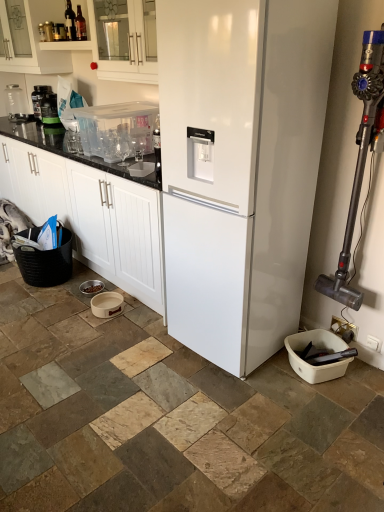
Question: Could you tell me if white glossy cabinet at center, acting as the first cabinetry starting from the bottom, is turned towards clear plastic container at upper left, marked as the 7th appliance in a front-to-back arrangement?

Choices:
 (A) yes
 (B) no

Answer: (B)

Question: Would you consider white glossy cabinet at center, acting as the first cabinetry starting from the bottom, to be distant from clear plastic container at upper left, the 1th appliance positioned from the left?

Choices:
 (A) yes
 (B) no

Answer: (A)

Question: Is white glossy cabinet at center, acting as the third cabinetry starting from the top, smaller than clear plastic container at upper left, the 1th appliance positioned from the left?

Choices:
 (A) yes
 (B) no

Answer: (B)

Question: Is white glossy cabinet at center, acting as the first cabinetry starting from the bottom, not inside clear plastic container at upper left, which is the 1th appliance in back-to-front order?

Choices:
 (A) yes
 (B) no

Answer: (A)

Question: Does white glossy cabinet at center, acting as the third cabinetry starting from the top, contain clear plastic container at upper left, acting as the seventh appliance starting from the right?

Choices:
 (A) no
 (B) yes

Answer: (A)

Question: From a real-world perspective, is beige ceramic bowl at lower center, positioned as the fourth appliance in back-to-front order, positioned above or below matte black coffee maker at left, placed as the fifth appliance when sorted from right to left?

Choices:
 (A) above
 (B) below

Answer: (B)

Question: From the image's perspective, is beige ceramic bowl at lower center, which is the fourth appliance in right-to-left order, located above or below matte black coffee maker at left, which is the 3th appliance in left-to-right order?

Choices:
 (A) above
 (B) below

Answer: (B)

Question: In terms of width, does beige ceramic bowl at lower center, which ranks as the 4th appliance in left-to-right order, look wider or thinner when compared to matte black coffee maker at left, which is the 5th appliance in front-to-back order?

Choices:
 (A) wide
 (B) thin

Answer: (A)

Question: Is beige ceramic bowl at lower center, positioned as the fourth appliance in back-to-front order, spatially inside matte black coffee maker at left, which ranks as the third appliance in back-to-front order, or outside of it?

Choices:
 (A) inside
 (B) outside

Answer: (B)

Question: Considering their positions, is dark glass bottle at upper left located in front of or behind transparent plastic container at upper left, arranged as the fifth appliance when viewed from the back?

Choices:
 (A) front
 (B) behind

Answer: (B)

Question: Is dark glass bottle at upper left wider or thinner than transparent plastic container at upper left, placed as the fifth appliance when sorted from left to right?

Choices:
 (A) wide
 (B) thin

Answer: (B)

Question: Visually, is dark glass bottle at upper left positioned to the left or to the right of transparent plastic container at upper left, the third appliance viewed from the front?

Choices:
 (A) left
 (B) right

Answer: (A)

Question: Choose the correct answer: Is dark glass bottle at upper left inside transparent plastic container at upper left, the third appliance viewed from the front, or outside it?

Choices:
 (A) outside
 (B) inside

Answer: (A)

Question: In terms of size, does clear plastic container at upper left, the 1th appliance positioned from the left, appear bigger or smaller than dark glass bottle at upper left?

Choices:
 (A) big
 (B) small

Answer: (A)

Question: From a real-world perspective, is clear plastic container at upper left, marked as the 7th appliance in a front-to-back arrangement, physically located above or below dark glass bottle at upper left?

Choices:
 (A) above
 (B) below

Answer: (B)